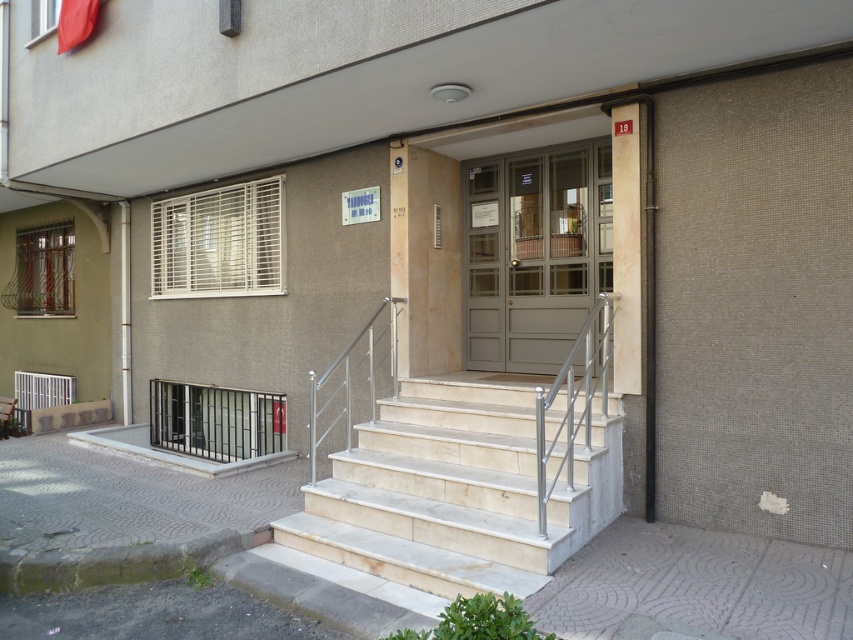
Question: Which point appears farthest from the camera in this image?

Choices:
 (A) (393, 310)
 (B) (444, 460)

Answer: (A)

Question: Does matte gray door at center appear under polished stainless steel handrail at center?

Choices:
 (A) yes
 (B) no

Answer: (B)

Question: Can you confirm if white marble stairs at center is smaller than polished stainless steel handrail at center?

Choices:
 (A) yes
 (B) no

Answer: (B)

Question: Which object is positioned farthest from the white marble stairs at center?

Choices:
 (A) polished stainless steel handrail at center
 (B) matte gray door at center

Answer: (B)

Question: Based on their relative distances, which object is nearer to the white marble stairs at center?

Choices:
 (A) polished stainless steel handrail at center
 (B) matte gray door at center

Answer: (A)

Question: Can you confirm if matte gray door at center is positioned to the right of polished stainless steel handrail at center?

Choices:
 (A) yes
 (B) no

Answer: (A)